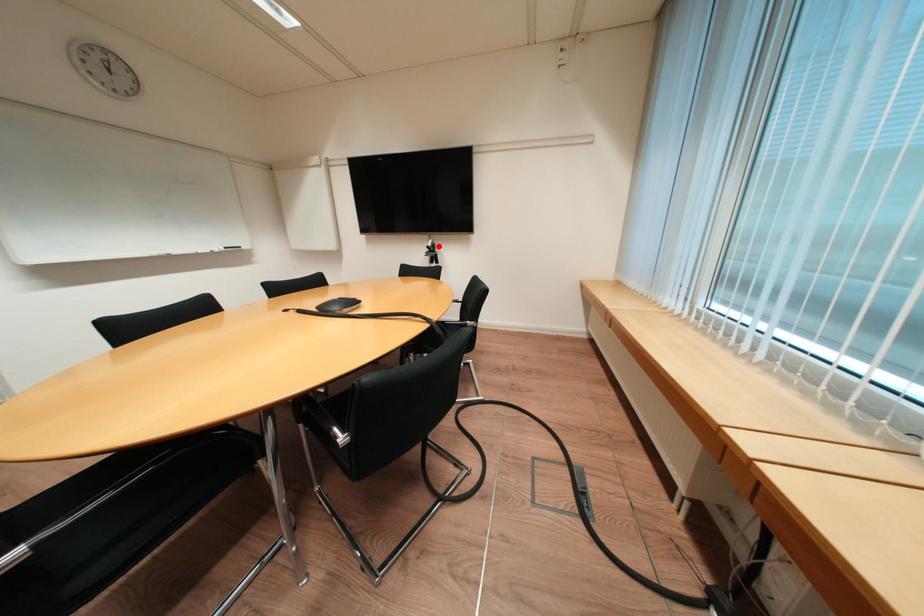
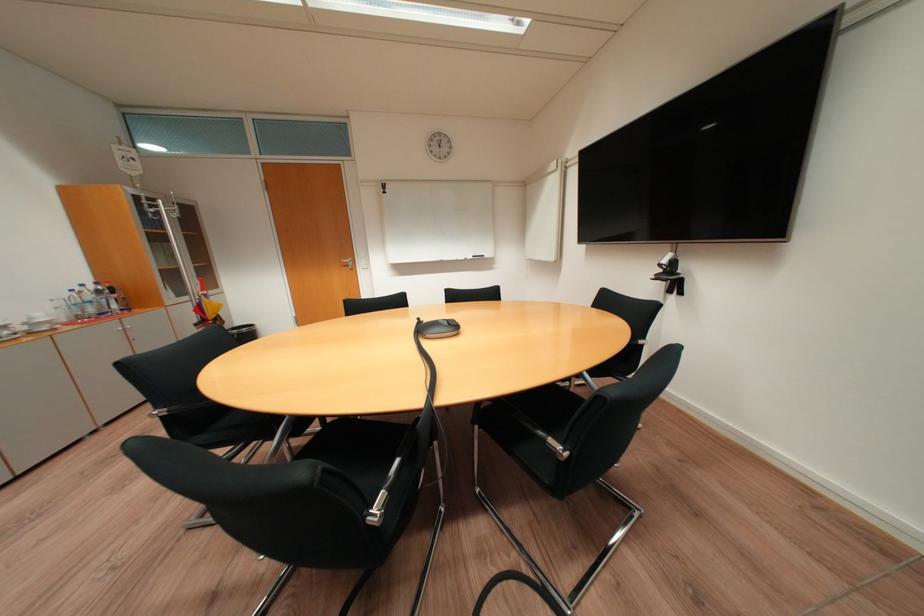
Find the pixel in the second image that matches the highlighted location in the first image.

(673, 262)